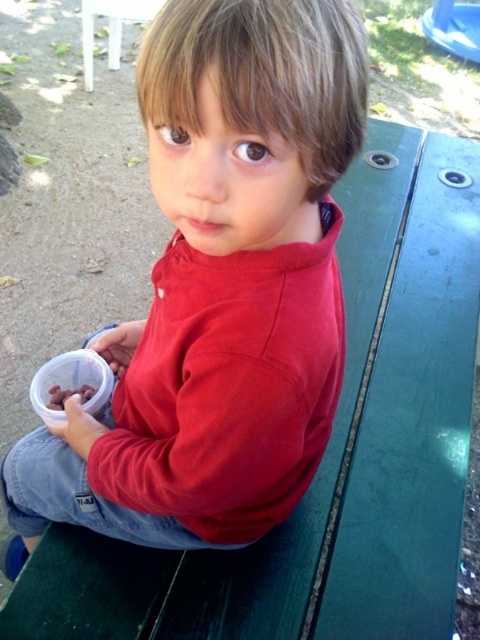
Who is positioned more to the right, matte red sweatshirt at center or brown matte nuts at lower left?

Positioned to the right is matte red sweatshirt at center.

Identify the location of matte red sweatshirt at center. (218, 289).